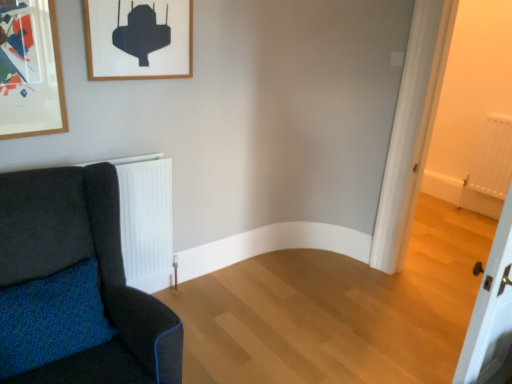
Question: Is velvet dark blue sofa at left taller than wooden picture frame at upper left?

Choices:
 (A) no
 (B) yes

Answer: (B)

Question: Can you confirm if velvet dark blue sofa at left is positioned to the left of wooden picture frame at upper left?

Choices:
 (A) no
 (B) yes

Answer: (B)

Question: From a real-world perspective, does velvet dark blue sofa at left sit lower than wooden picture frame at upper left?

Choices:
 (A) no
 (B) yes

Answer: (B)

Question: Is velvet dark blue sofa at left completely or partially outside of wooden picture frame at upper left?

Choices:
 (A) yes
 (B) no

Answer: (A)

Question: Is velvet dark blue sofa at left aimed at wooden picture frame at upper left?

Choices:
 (A) no
 (B) yes

Answer: (A)

Question: Based on their positions, is velvet dark blue sofa at left located to the left or right of white matte radiator at right?

Choices:
 (A) right
 (B) left

Answer: (B)

Question: Choose the correct answer: Is velvet dark blue sofa at left inside white matte radiator at right or outside it?

Choices:
 (A) outside
 (B) inside

Answer: (A)

Question: From the image's perspective, is velvet dark blue sofa at left above or below white matte radiator at right?

Choices:
 (A) above
 (B) below

Answer: (B)

Question: From a real-world perspective, is velvet dark blue sofa at left physically located above or below white matte radiator at right?

Choices:
 (A) below
 (B) above

Answer: (A)

Question: Considering their positions, is wooden picture frame at upper left located in front of or behind white matte radiator at right?

Choices:
 (A) front
 (B) behind

Answer: (A)

Question: From a real-world perspective, is wooden picture frame at upper left positioned above or below white matte radiator at right?

Choices:
 (A) above
 (B) below

Answer: (A)

Question: Considering the positions of wooden picture frame at upper left and white matte radiator at right in the image, is wooden picture frame at upper left taller or shorter than white matte radiator at right?

Choices:
 (A) tall
 (B) short

Answer: (B)

Question: Considering the positions of point (147, 23) and point (496, 168), is point (147, 23) closer or farther from the camera than point (496, 168)?

Choices:
 (A) farther
 (B) closer

Answer: (B)

Question: From a real-world perspective, is white matte radiator at right positioned above or below velvet dark blue sofa at left?

Choices:
 (A) above
 (B) below

Answer: (A)

Question: Considering their positions, is white matte radiator at right located in front of or behind velvet dark blue sofa at left?

Choices:
 (A) front
 (B) behind

Answer: (B)